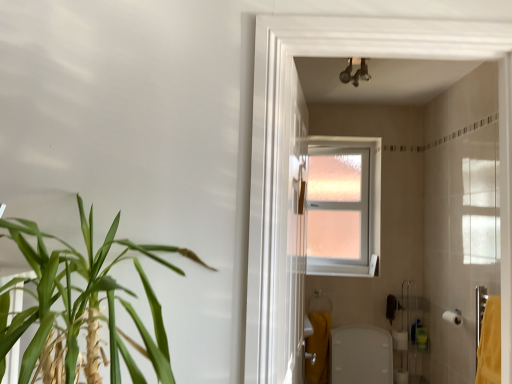
This screenshot has height=384, width=512. What do you see at coordinates (490, 344) in the screenshot?
I see `yellow fabric towel at right, the 1th bath towel from the front` at bounding box center [490, 344].

You are a GUI agent. You are given a task and a screenshot of the screen. Output one action in this format:
    pyautogui.click(x=<x>, y=<y>)
    Task: Click on the green leafy plant at left
    
    Given the screenshot: What is the action you would take?
    pyautogui.click(x=82, y=307)

You are a GUI agent. You are given a task and a screenshot of the screen. Output one action in this format:
    pyautogui.click(x=<x>, y=<y>)
    Task: Click on the white matte toilet paper at lower right, the first toilet paper positioned from the front
    The width and height of the screenshot is (512, 384).
    Given the screenshot: What is the action you would take?
    pyautogui.click(x=453, y=318)

At what (x,y) coordinates should I click in order to perform the action: click on clear glass window at upper center. Please return your answer as a coordinate pair (x, y). Looking at the image, I should click on (343, 206).

Starting from the clear glass screen door at center, which toilet paper is the 2nd one to the right? Please provide its 2D coordinates.

[(453, 318)]

Is clear glass screen door at center not near white matte toilet paper at lower right, placed as the second toilet paper when sorted from back to front?

Yes, clear glass screen door at center and white matte toilet paper at lower right, placed as the second toilet paper when sorted from back to front, are quite far apart.

Is clear glass screen door at center oriented towards white matte toilet paper at lower right, which is the 2th toilet paper in left-to-right order?

No, clear glass screen door at center does not turn towards white matte toilet paper at lower right, which is the 2th toilet paper in left-to-right order.

Locate an element on the screen. This screenshot has height=384, width=512. the 1st bath towel in front of the white matte toilet paper at lower right, which is counted as the first toilet paper, starting from the back is located at coordinates (318, 347).

Between yellow fabric bath towel at lower right, which is the second bath towel in front-to-back order, and white matte toilet paper at lower right, marked as the first toilet paper in a bottom-to-top arrangement, which one is positioned in front?

yellow fabric bath towel at lower right, which is the second bath towel in front-to-back order, is more forward.

Based on their positions, is yellow fabric bath towel at lower right, positioned as the 2th bath towel in right-to-left order, located to the left or right of white matte toilet paper at lower right, which is counted as the first toilet paper, starting from the back?

Clearly, yellow fabric bath towel at lower right, positioned as the 2th bath towel in right-to-left order, is on the left of white matte toilet paper at lower right, which is counted as the first toilet paper, starting from the back, in the image.

Find the location of a particular element. The height and width of the screenshot is (384, 512). light fixture behind the green leafy plant at left is located at coordinates (355, 73).

Based on the photo, is green leafy plant at left positioned with its back to metallic chrome light fixture at upper center?

That's not correct — green leafy plant at left is not looking away from metallic chrome light fixture at upper center.

Does green leafy plant at left have a greater width compared to metallic chrome light fixture at upper center?

Yes.

Which is further, (19, 246) or (359, 73)?

The point (359, 73) is more distant.

In the scene shown: Is white matte toilet paper at lower right, placed as the second toilet paper when sorted from back to front, oriented away from metallic chrome light fixture at upper center?

No, white matte toilet paper at lower right, placed as the second toilet paper when sorted from back to front, is not facing away from metallic chrome light fixture at upper center.

Does point (453, 312) come behind point (347, 75)?

Yes, it is behind point (347, 75).

Considering the relative sizes of white matte toilet paper at lower right, which is the 2th toilet paper in left-to-right order, and metallic chrome light fixture at upper center in the image provided, is white matte toilet paper at lower right, which is the 2th toilet paper in left-to-right order, smaller than metallic chrome light fixture at upper center?

Yes, white matte toilet paper at lower right, which is the 2th toilet paper in left-to-right order, is smaller than metallic chrome light fixture at upper center.

Can you confirm if white matte toilet paper at lower right, the first toilet paper positioned from the front, is wider than metallic chrome light fixture at upper center?

Incorrect, the width of white matte toilet paper at lower right, the first toilet paper positioned from the front, does not surpass that of metallic chrome light fixture at upper center.

Does yellow fabric towel at right, which ranks as the 1th bath towel in right-to-left order, appear on the right side of clear glass window at upper center?

Yes, yellow fabric towel at right, which ranks as the 1th bath towel in right-to-left order, is to the right of clear glass window at upper center.

Does yellow fabric towel at right, positioned as the 1th bath towel in top-to-bottom order, touch clear glass window at upper center?

No, yellow fabric towel at right, positioned as the 1th bath towel in top-to-bottom order, is not beside clear glass window at upper center.

Does point (498, 306) appear closer or farther from the camera than point (364, 150)?

Point (498, 306) is positioned closer to the camera compared to point (364, 150).

What's the angular difference between yellow fabric towel at right, the second bath towel in the left-to-right sequence, and clear glass window at upper center's facing directions?

90.4 degrees separate the facing orientations of yellow fabric towel at right, the second bath towel in the left-to-right sequence, and clear glass window at upper center.

Would you say green leafy plant at left is part of yellow fabric bath towel at lower right, which is counted as the second bath towel, starting from the top,'s contents?

Actually, green leafy plant at left is outside yellow fabric bath towel at lower right, which is counted as the second bath towel, starting from the top.

From the image's perspective, is yellow fabric bath towel at lower right, which is counted as the second bath towel, starting from the top, positioned above or below green leafy plant at left?

From the image's perspective, yellow fabric bath towel at lower right, which is counted as the second bath towel, starting from the top, appears below green leafy plant at left.

Is yellow fabric bath towel at lower right, which is the second bath towel in front-to-back order, aimed at green leafy plant at left?

No, yellow fabric bath towel at lower right, which is the second bath towel in front-to-back order, is not oriented towards green leafy plant at left.

Image resolution: width=512 pixels, height=384 pixels. Find the location of `toilet paper located underneath the white matte toilet paper at lower right, placed as the second toilet paper when sorted from bottom to top (from a real-world perspective)`. toilet paper located underneath the white matte toilet paper at lower right, placed as the second toilet paper when sorted from bottom to top (from a real-world perspective) is located at coordinates (400, 340).

Which of these two, white matte toilet paper at lower right, which is the 2th toilet paper in left-to-right order, or white matte toilet paper at lower right, the first toilet paper from the left, is smaller?

white matte toilet paper at lower right, which is the 2th toilet paper in left-to-right order.

Based on the photo, from the image's perspective, who appears lower, white matte toilet paper at lower right, placed as the 1th toilet paper when sorted from top to bottom, or white matte toilet paper at lower right, which is counted as the second toilet paper, starting from the front?

white matte toilet paper at lower right, which is counted as the second toilet paper, starting from the front, from the image's perspective.

Is white matte toilet paper at lower right, which is the 2th toilet paper in left-to-right order, inside the boundaries of white matte toilet paper at lower right, marked as the first toilet paper in a bottom-to-top arrangement, or outside?

white matte toilet paper at lower right, which is the 2th toilet paper in left-to-right order, exists outside the volume of white matte toilet paper at lower right, marked as the first toilet paper in a bottom-to-top arrangement.

The image size is (512, 384). I want to click on toilet paper that is the 1st one when counting backward from the clear glass screen door at center, so click(453, 318).

The height and width of the screenshot is (384, 512). I want to click on bath towel below the white matte toilet paper at lower right, marked as the first toilet paper in a bottom-to-top arrangement (from the image's perspective), so click(x=318, y=347).

Estimate the real-world distances between objects in this image. Which object is closer to clear glass screen door at center, clear glass window at upper center or yellow fabric towel at right, the second bath towel when ordered from back to front?

yellow fabric towel at right, the second bath towel when ordered from back to front, is positioned closer to the anchor clear glass screen door at center.

Which object lies further to the anchor point green leafy plant at left, white matte toilet paper at lower right, placed as the 1th toilet paper when sorted from top to bottom, or yellow fabric bath towel at lower right, which is counted as the second bath towel, starting from the top?

white matte toilet paper at lower right, placed as the 1th toilet paper when sorted from top to bottom.

Which object lies nearer to the anchor point white matte toilet paper at lower right, marked as the first toilet paper in a bottom-to-top arrangement, metallic chrome light fixture at upper center or yellow fabric towel at right, which ranks as the 1th bath towel in right-to-left order?

Among the two, yellow fabric towel at right, which ranks as the 1th bath towel in right-to-left order, is located nearer to white matte toilet paper at lower right, marked as the first toilet paper in a bottom-to-top arrangement.

From the image, which object appears to be farther from white matte toilet paper at lower right, placed as the second toilet paper when sorted from back to front, yellow fabric towel at right, positioned as the 1th bath towel in top-to-bottom order, or yellow fabric bath towel at lower right, which is counted as the second bath towel, starting from the top?

Based on the image, yellow fabric bath towel at lower right, which is counted as the second bath towel, starting from the top, appears to be further to white matte toilet paper at lower right, placed as the second toilet paper when sorted from back to front.

From the picture: Considering their positions, is white matte toilet paper at lower right, placed as the 1th toilet paper when sorted from top to bottom, positioned further to green leafy plant at left than yellow fabric towel at right, which ranks as the 1th bath towel in right-to-left order?

Based on the image, white matte toilet paper at lower right, placed as the 1th toilet paper when sorted from top to bottom, appears to be further to green leafy plant at left.

Estimate the real-world distances between objects in this image. Which object is closer to clear glass screen door at center, white matte toilet paper at lower right, placed as the 1th toilet paper when sorted from right to left, or green leafy plant at left?

The object closer to clear glass screen door at center is green leafy plant at left.

When comparing their distances from metallic chrome light fixture at upper center, does clear glass screen door at center or clear glass window at upper center seem closer?

clear glass screen door at center.

When comparing their distances from clear glass screen door at center, does metallic chrome light fixture at upper center or yellow fabric bath towel at lower right, which is counted as the first bath towel, starting from the left, seem further?

yellow fabric bath towel at lower right, which is counted as the first bath towel, starting from the left, lies further to clear glass screen door at center than the other object.

Find the location of a particular element. Image resolution: width=512 pixels, height=384 pixels. toilet paper situated between yellow fabric bath towel at lower right, positioned as the 2th bath towel in right-to-left order, and white matte toilet paper at lower right, placed as the 1th toilet paper when sorted from top to bottom, from left to right is located at coordinates (400, 340).

At what (x,y) coordinates should I click in order to perform the action: click on toilet paper between yellow fabric towel at right, positioned as the 1th bath towel in top-to-bottom order, and yellow fabric bath towel at lower right, positioned as the 2th bath towel in right-to-left order, from front to back. Please return your answer as a coordinate pair (x, y). Looking at the image, I should click on (453, 318).

In order to click on window that lies between metallic chrome light fixture at upper center and yellow fabric bath towel at lower right, the 1th bath towel from the bottom, from top to bottom in this screenshot , I will do `click(343, 206)`.

This screenshot has height=384, width=512. Find the location of `toilet paper between clear glass screen door at center and white matte toilet paper at lower right, arranged as the second toilet paper when viewed from the top, in the front-back direction`. toilet paper between clear glass screen door at center and white matte toilet paper at lower right, arranged as the second toilet paper when viewed from the top, in the front-back direction is located at coordinates (453, 318).